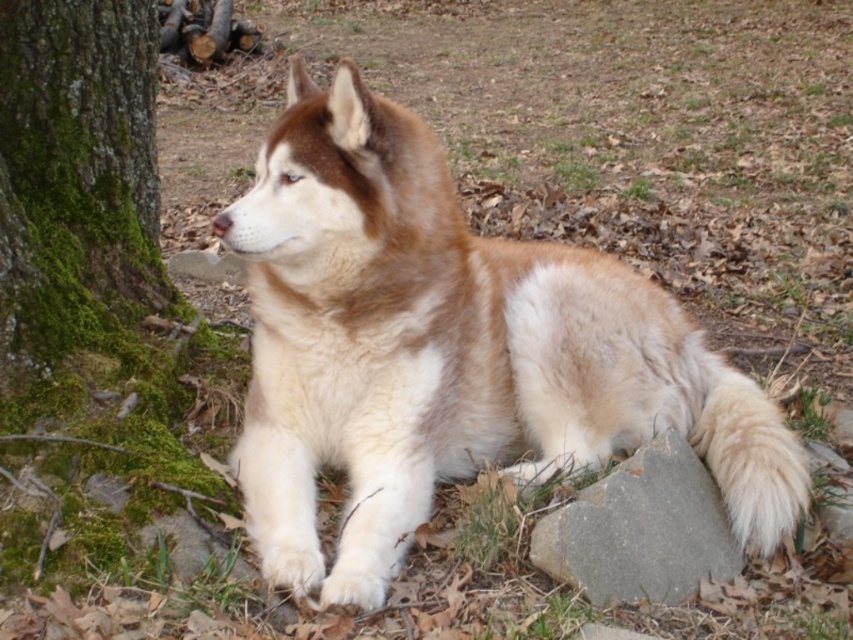
Can you confirm if fuzzy fur dog at center is positioned below gray smooth stone at lower right?

Incorrect, fuzzy fur dog at center is not positioned below gray smooth stone at lower right.

Who is higher up, fuzzy fur dog at center or gray smooth stone at lower right?

fuzzy fur dog at center is above.

Between point (418, 385) and point (563, 561), which one is positioned in front?

Positioned in front is point (563, 561).

The image size is (853, 640). I want to click on fuzzy fur dog at center, so click(450, 352).